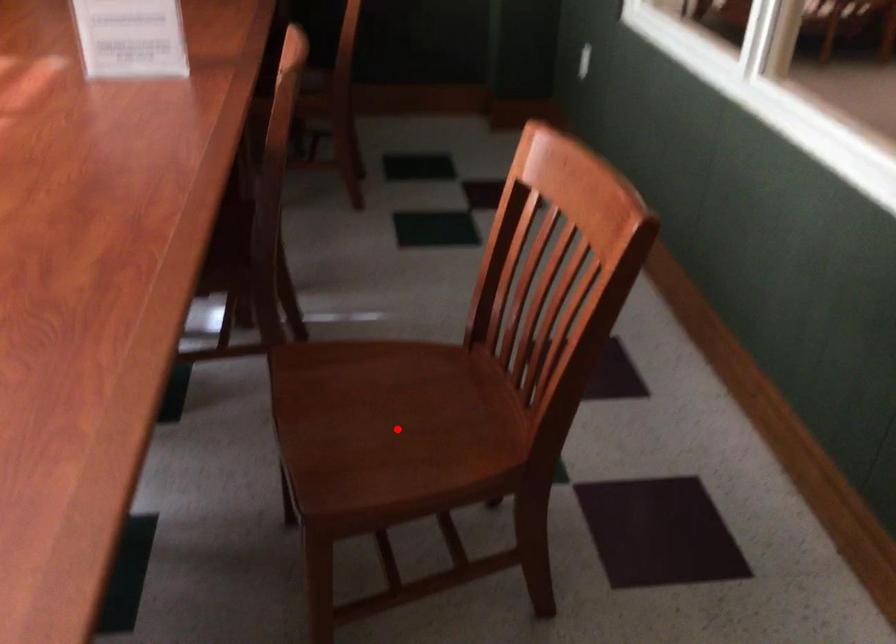
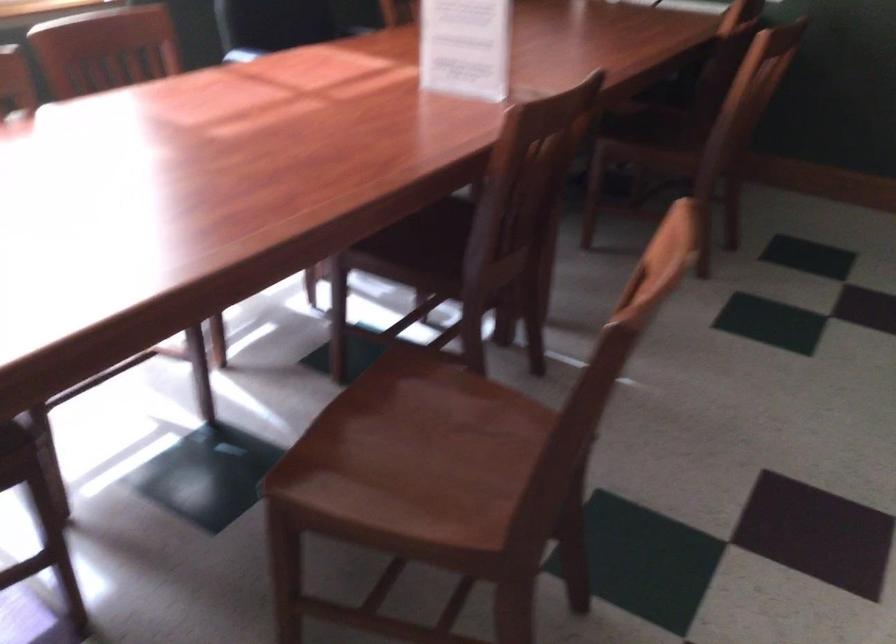
Locate, in the second image, the point that corresponds to the highlighted location in the first image.

(412, 458)